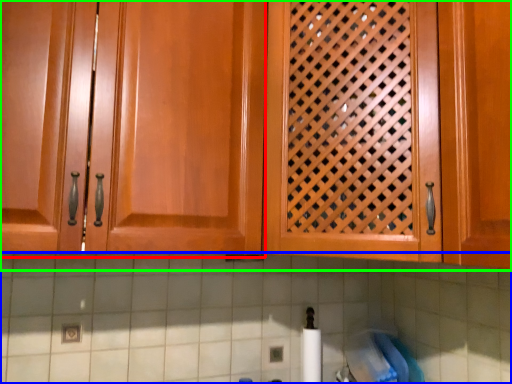
Question: Which object is the closest to the cabinetry (highlighted by a red box)? Choose among these: granite (highlighted by a blue box) or cabinetry (highlighted by a green box).

Choices:
 (A) granite
 (B) cabinetry

Answer: (B)